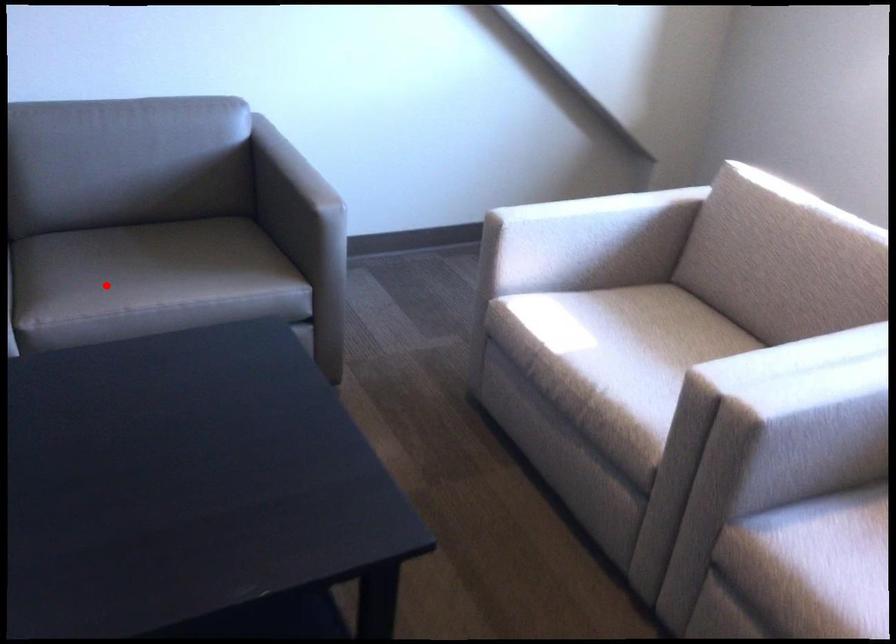
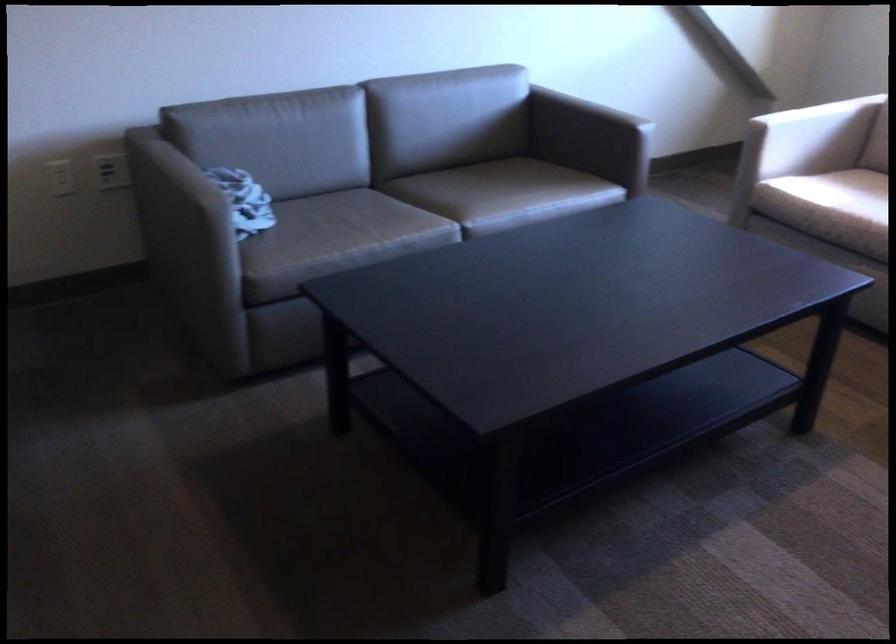
Question: I am providing you with two images of the same scene from different viewpoints. Given a red point in image1, look at the same physical point in image2. Is it:

Choices:
 (A) Closer to the viewpoint
 (B) Farther from the viewpoint

Answer: (B)